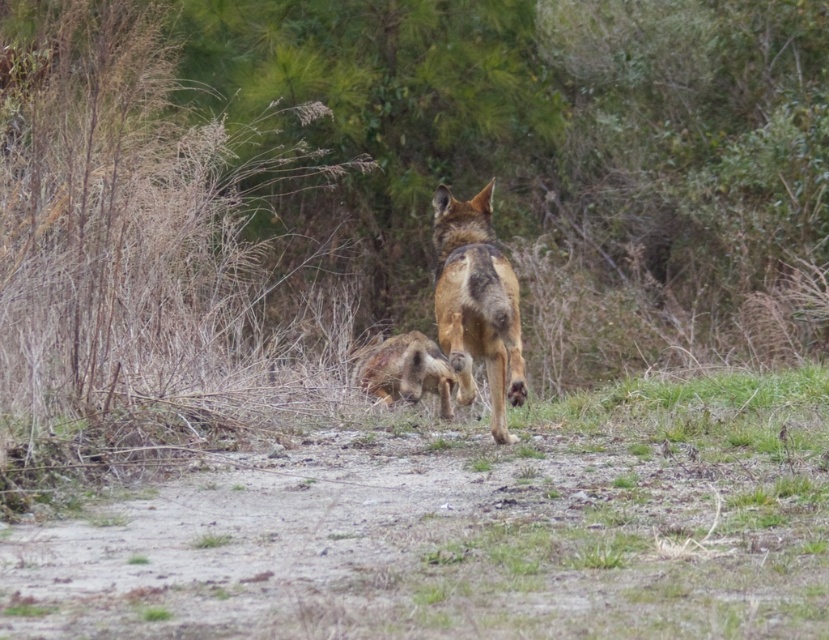
You are standing on the sandy path and see the brown dirt field at center and the furry brown animal at center. Which one is closer to the ground?

The brown dirt field at center is located below the furry brown animal at center, so the brown dirt field at center is closer to the ground.

You are a photographer trying to capture the brown fur dog at center in your shot. The brown dirt field at center is blocking part of the dog. Can you adjust your position to get a clearer view of the dog without moving the field?

The brown dirt field at center is smaller than the brown fur dog at center, so you can move your position to either side to avoid the obstruction caused by the smaller field and get a clearer view of the dog.

You are a photographer trying to capture both the brown dirt field at center and the furry brown animal at center in a single frame. Based on the scene, which object occupies more horizontal space in the image?

The brown dirt field at center is wider than the furry brown animal at center, so it occupies more horizontal space in the image.